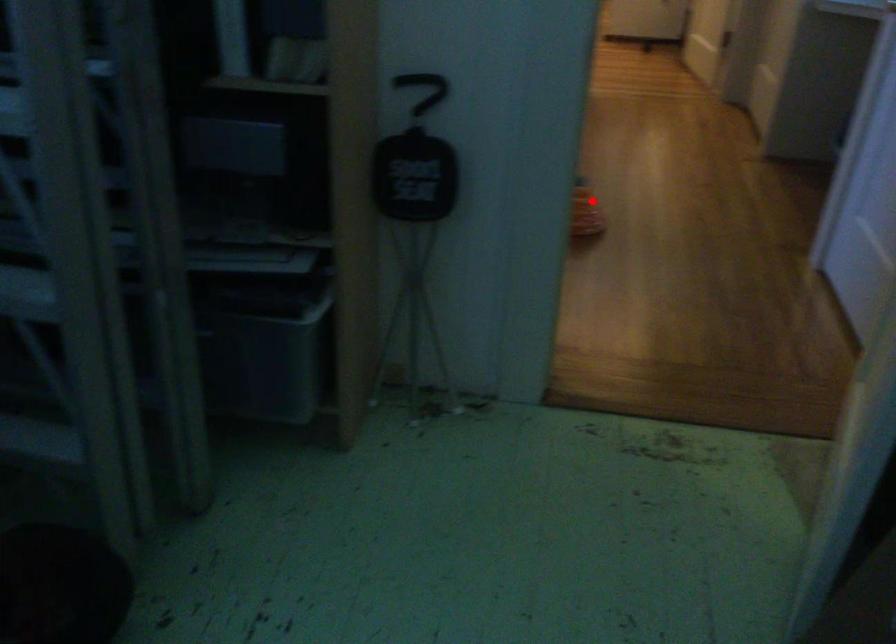
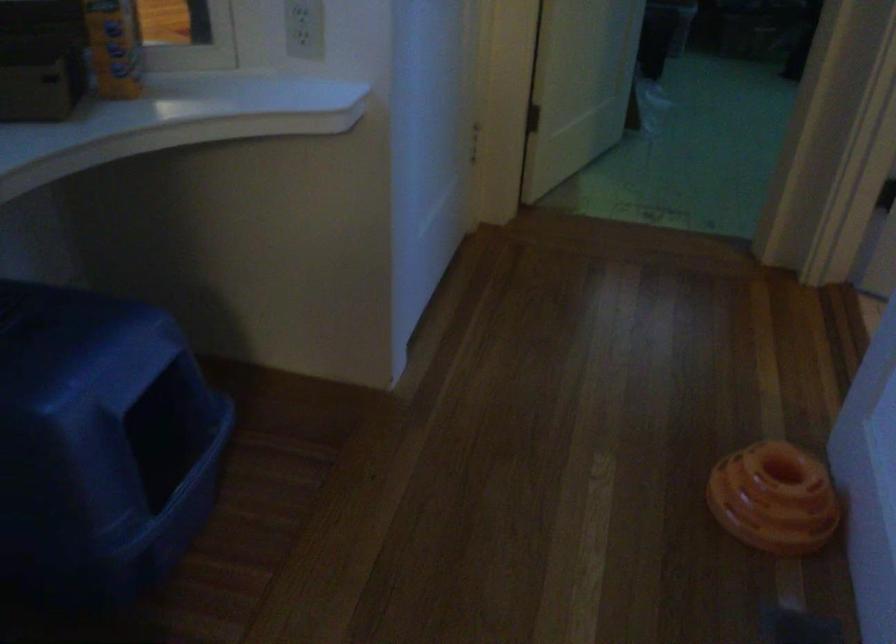
Locate, in the second image, the point that corresponds to the highlighted location in the first image.

(773, 498)